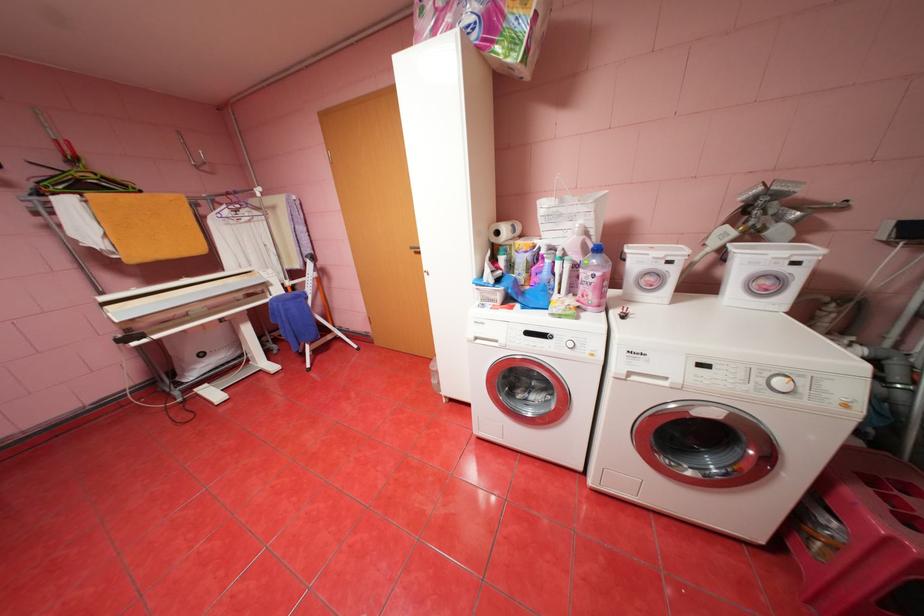
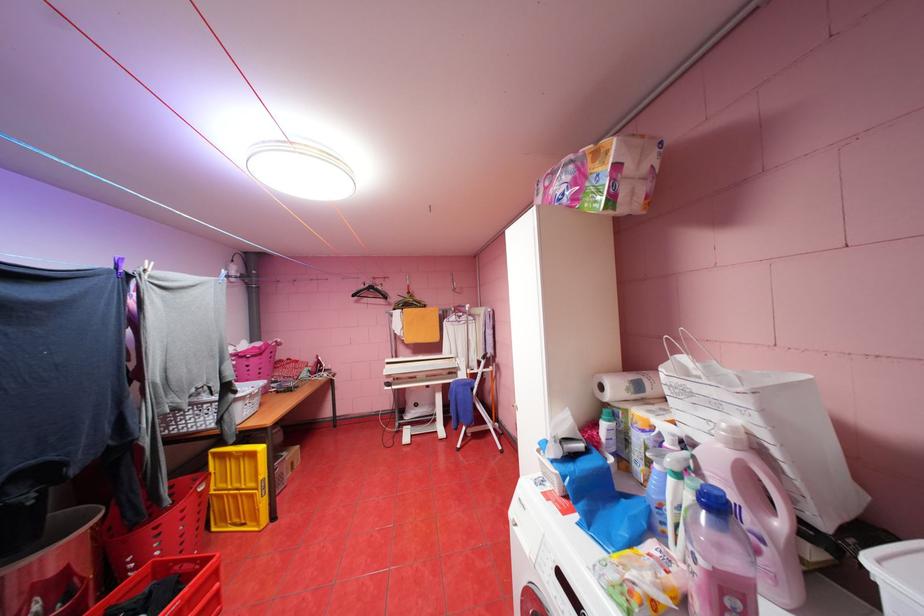
Locate, in the second image, the point that corresponds to the point at 601,213 in the first image.

(763, 413)